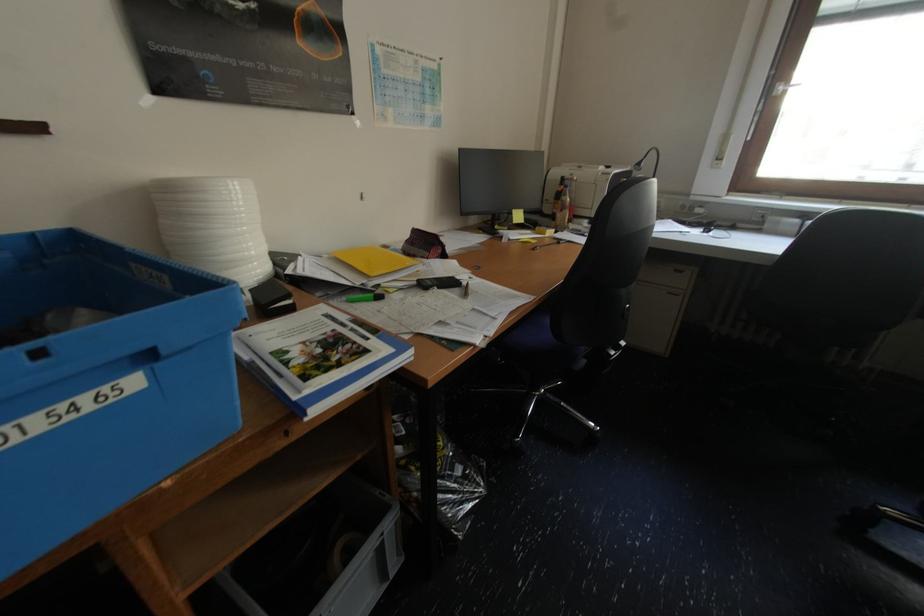
The width and height of the screenshot is (924, 616). Identify the location of window handle. (784, 87).